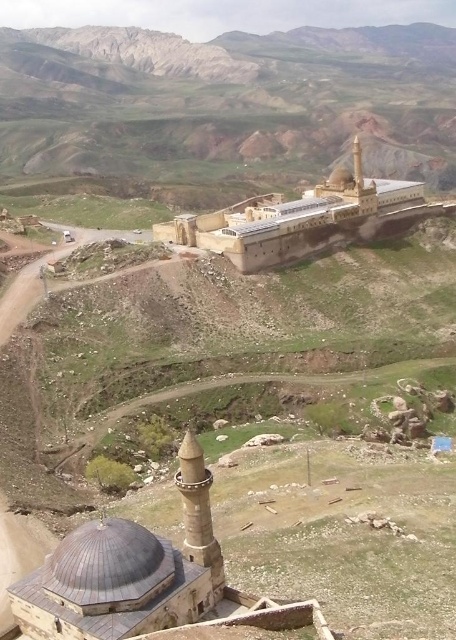
You are a tour guide leading a group to the beige stone building at center. There is a brown rocky mountain at upper center that might block the view. Can you confirm if the mountain is closer than 200 meters to the building?

The distance between the brown rocky mountain at upper center and the beige stone building at center is 195.27 meters, which is less than 200 meters. Therefore, the mountain is closer than 200 meters to the building.

You are a tourist planning to take a photo of the beige stone building at center. However, you want to ensure the brown rocky mountain at upper center doesn not block the view. Based on the scene description, can you determine if the mountain will obscure the building in your photo?

The brown rocky mountain at upper center is larger in size than beige stone building at center, so it may block the view depending on the angle and distance. However, since the mountain is at the upper center and the building is at the center, adjusting the camera angle downward might allow capturing the beige stone building at center without obstruction from the mountain.